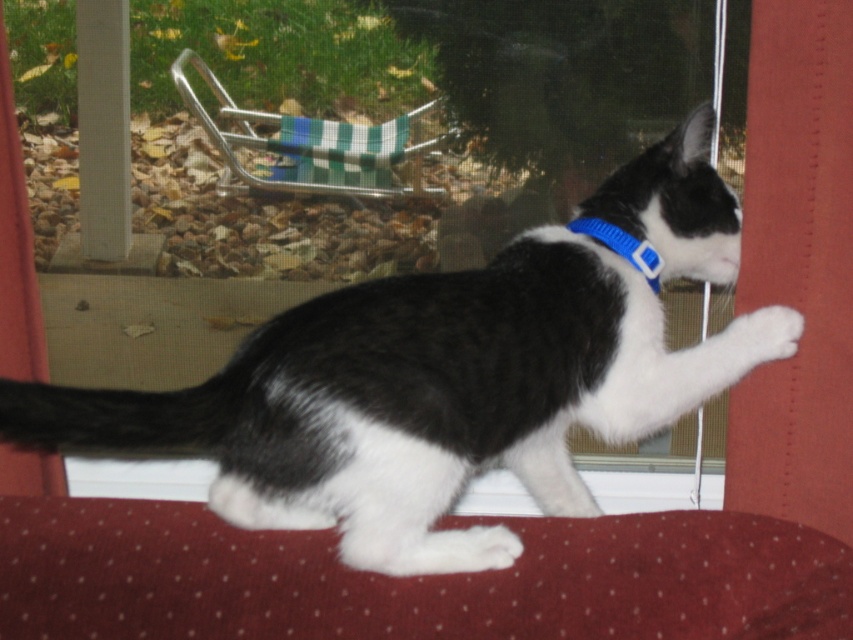
Question: Is green checkered fabric chair at upper center bigger than blue fabric neckband at upper center?

Choices:
 (A) yes
 (B) no

Answer: (A)

Question: Is black/white fur cat at center to the right of green checkered fabric chair at upper center from the viewer's perspective?

Choices:
 (A) no
 (B) yes

Answer: (B)

Question: Which object is farther from the camera taking this photo?

Choices:
 (A) blue fabric neckband at upper center
 (B) green checkered fabric chair at upper center

Answer: (B)

Question: Which point is farther from the camera taking this photo?

Choices:
 (A) (170, 422)
 (B) (613, 243)
 (C) (328, 132)

Answer: (C)

Question: Which of these objects is positioned farthest from the green checkered fabric chair at upper center?

Choices:
 (A) black/white fur cat at center
 (B) blue fabric neckband at upper center

Answer: (A)

Question: Can you confirm if black/white fur cat at center is positioned to the right of green checkered fabric chair at upper center?

Choices:
 (A) yes
 (B) no

Answer: (A)